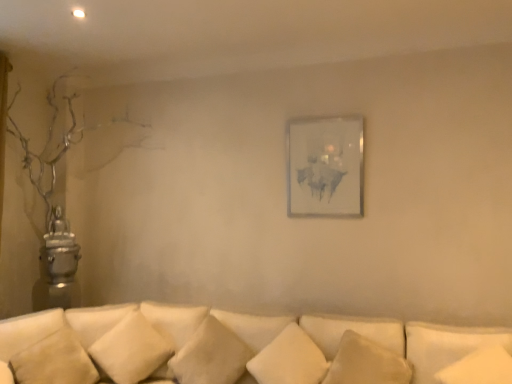
Question: From the image's perspective, is white soft pillow at lower left, which is the 1th pillow from left to right, over matte white picture frame at center?

Choices:
 (A) no
 (B) yes

Answer: (A)

Question: Is white soft pillow at lower left, which appears as the seventh pillow when viewed from the right, bigger than matte white picture frame at center?

Choices:
 (A) no
 (B) yes

Answer: (B)

Question: Is white soft pillow at lower left, which appears as the seventh pillow when viewed from the right, to the right of matte white picture frame at center from the viewer's perspective?

Choices:
 (A) no
 (B) yes

Answer: (A)

Question: From the image's perspective, would you say white soft pillow at lower left, which is the 1th pillow from left to right, is shown under matte white picture frame at center?

Choices:
 (A) yes
 (B) no

Answer: (A)

Question: Can we say white soft pillow at lower left, which is the 1th pillow from left to right, lies outside matte white picture frame at center?

Choices:
 (A) yes
 (B) no

Answer: (A)

Question: Considering the relative positions of white soft pillow at lower left, which appears as the seventh pillow when viewed from the right, and matte white picture frame at center in the image provided, is white soft pillow at lower left, which appears as the seventh pillow when viewed from the right, behind matte white picture frame at center?

Choices:
 (A) no
 (B) yes

Answer: (A)

Question: Is beige fabric pillow at lower left, the second pillow from the left, touching white soft pillow at lower left, which is the 1th pillow from left to right?

Choices:
 (A) no
 (B) yes

Answer: (A)

Question: Could white soft pillow at lower left, which appears as the seventh pillow when viewed from the right, be considered to be inside beige fabric pillow at lower left, the second pillow from the left?

Choices:
 (A) yes
 (B) no

Answer: (A)

Question: Is beige fabric pillow at lower left, which is the 6th pillow from right to left, wider than white soft pillow at lower left, which appears as the seventh pillow when viewed from the right?

Choices:
 (A) no
 (B) yes

Answer: (B)

Question: Is beige fabric pillow at lower left, which is the 6th pillow from right to left, at the right side of white soft pillow at lower left, which appears as the seventh pillow when viewed from the right?

Choices:
 (A) no
 (B) yes

Answer: (B)

Question: Can you confirm if beige fabric pillow at lower left, the second pillow from the left, is smaller than white soft pillow at lower left, which is the 1th pillow from left to right?

Choices:
 (A) no
 (B) yes

Answer: (A)

Question: From the image's perspective, does beige fabric pillow at lower left, which is the 6th pillow from right to left, appear lower than white soft pillow at lower left, which appears as the seventh pillow when viewed from the right?

Choices:
 (A) yes
 (B) no

Answer: (A)

Question: Is white soft pillow at lower center, the 6th pillow when ordered from left to right, taller than matte white picture frame at center?

Choices:
 (A) no
 (B) yes

Answer: (A)